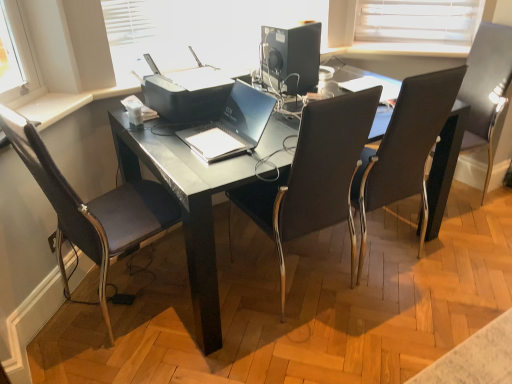
Locate an element on the screen. The image size is (512, 384). vacant area that lies between dark brown leather chair at left, positioned as the 1th chair in left-to-right order, and black leather chair at center, which is the third chair in right-to-left order is located at coordinates (219, 296).